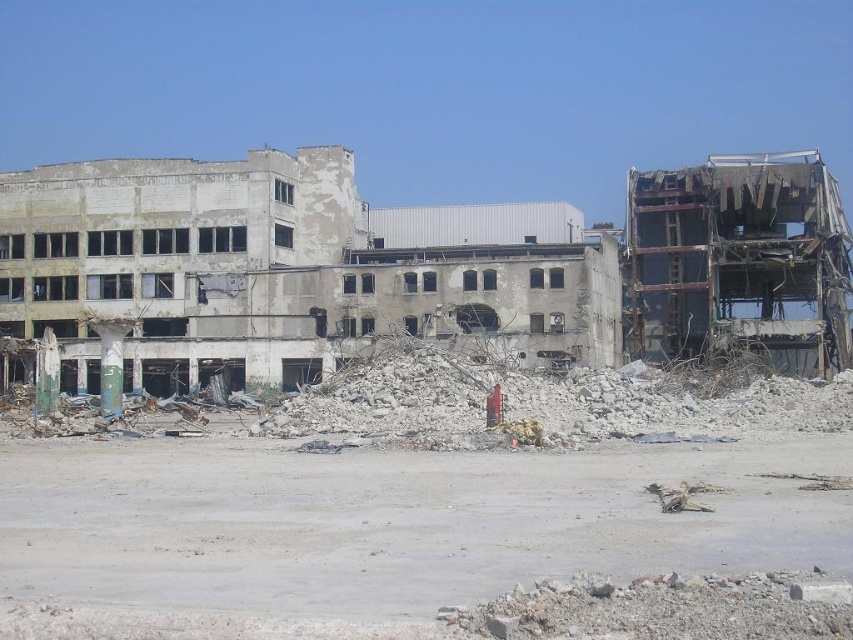
From the picture: You are a construction worker assessing the site. You notice two piles of gray rubble at center and gray concrete rubble at center. Which pile is directly above the other?

The gray concrete rubble at center is directly above the gray rubble at center because the gray rubble at center is positioned under it.

You are a drone operator trying to capture aerial footage of the urban decay scene. You notice two points of interest marked as point [231,576] and point [509,216]. Which point should you focus on first if you want to ensure the closest object is captured clearly?

Point [231,576] is closer to the camera than point [509,216], so focusing on point [231,576] first will ensure the closest object is captured clearly.

You are a construction worker standing at the edge of the scene. You need to assess the safety of approaching the gray rubble at center. Given that the safe distance for such rubble piles is at least 100 feet, is the current distance sufficient?

The gray rubble at center is 81.49 feet away from the viewer. Since the safe distance required is 100 feet, the current distance is insufficient for safety.